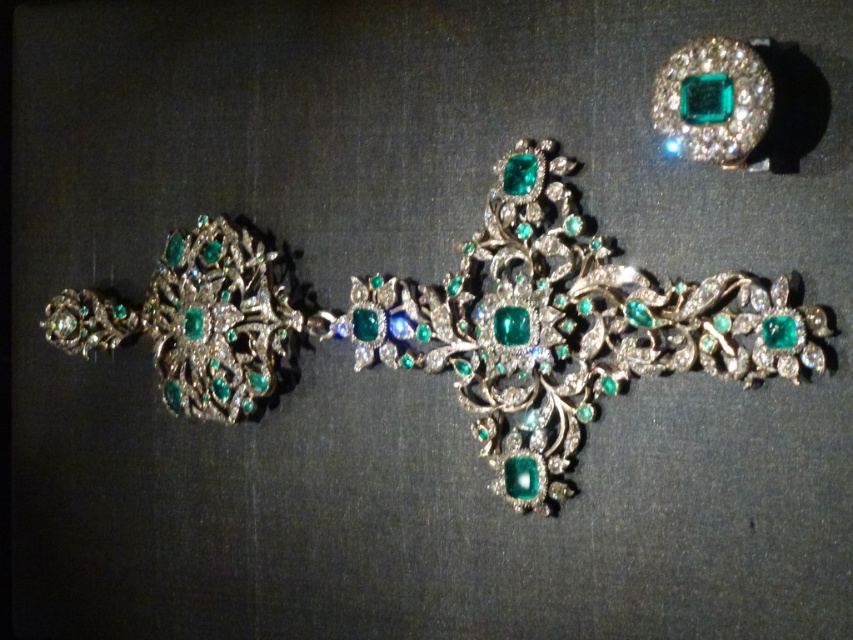
You are an appraiser examining a jewelry piece. The brooch is at point (x=459, y=324). You need to determine if it is centered on the image. The image has a coordinate system from 0 to 1 in both x and y. Is the matte silver brooch at center left located at the center of the image?

The matte silver brooch at center left is located at point (x=459, y=324). Since the center of the image would be at coordinates approximately 0.5, 0.5, the brooch is slightly to the right and above the exact center, but very close. However, the description states it is at center left, which might indicate it is positioned near the center but slightly to the left. There might be a discrepancy between the coordinate and the description.

You are an appraiser examining the jewelry piece. You notice two points marked on the image. One is at coordinate point (59, 310) and the other at point (733, 115). From your viewpoint, which point is closer to you?

Point (733, 115) is closer to you because it is in front of point (59, 310).